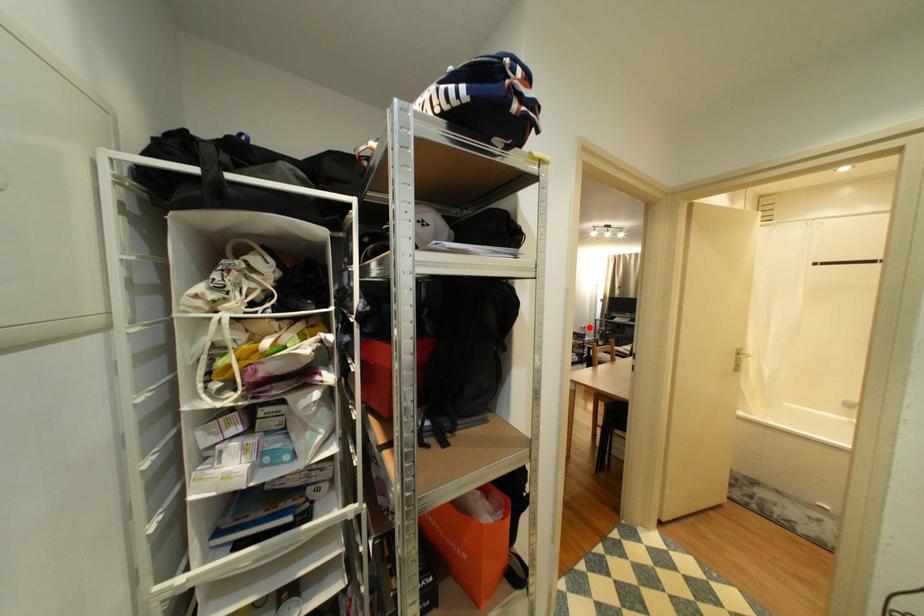
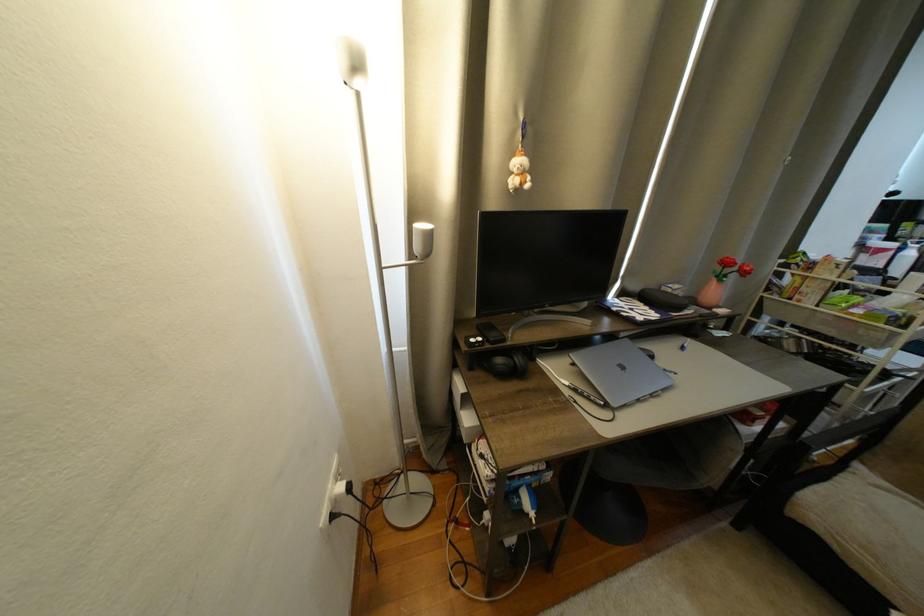
Locate, in the second image, the point that corresponds to the highlighted location in the first image.

(333, 520)